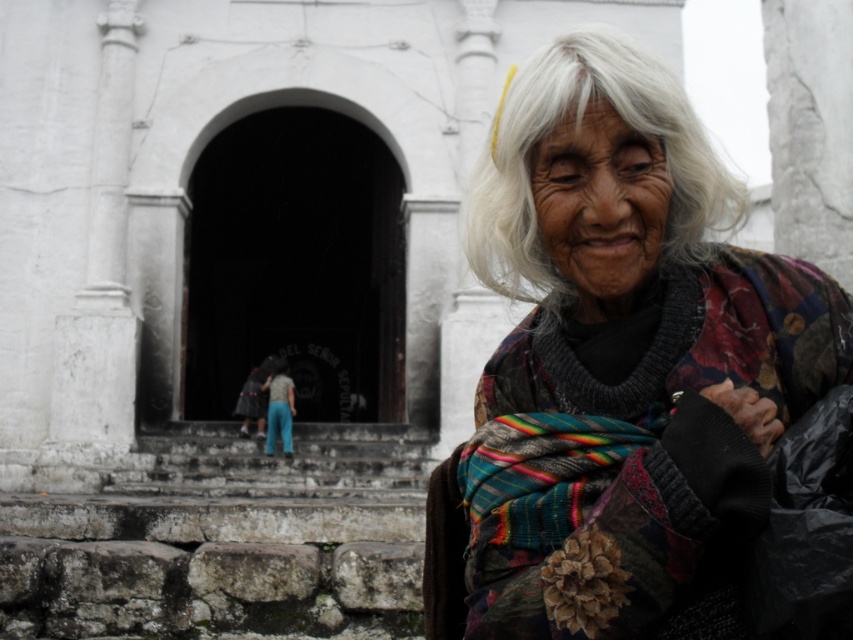
The width and height of the screenshot is (853, 640). What do you see at coordinates (621, 362) in the screenshot? I see `multicolored woven shawl at center` at bounding box center [621, 362].

Find the location of `multicolored woven shawl at center`. multicolored woven shawl at center is located at coordinates (621, 362).

Who is more distant from viewer, [517,515] or [300,632]?

Point [300,632]

Image resolution: width=853 pixels, height=640 pixels. I want to click on multicolored woven shawl at center, so click(621, 362).

Does white silky hair at center have a greater height compared to white stone wall at upper right?

Correct, white silky hair at center is much taller as white stone wall at upper right.

Based on the photo, can you confirm if white silky hair at center is smaller than white stone wall at upper right?

Actually, white silky hair at center might be larger than white stone wall at upper right.

Where is `white silky hair at center`? The width and height of the screenshot is (853, 640). white silky hair at center is located at coordinates (577, 125).

At what (x,y) coordinates should I click in order to perform the action: click on white silky hair at center. Please return your answer as a coordinate pair (x, y). Image resolution: width=853 pixels, height=640 pixels. Looking at the image, I should click on (577, 125).

Can you confirm if stone steps at lower left is taller than white stone wall at upper right?

No.

Consider the image. Between stone steps at lower left and white stone wall at upper right, which one appears on the right side from the viewer's perspective?

white stone wall at upper right is more to the right.

Find the location of a particular element. stone steps at lower left is located at coordinates (219, 536).